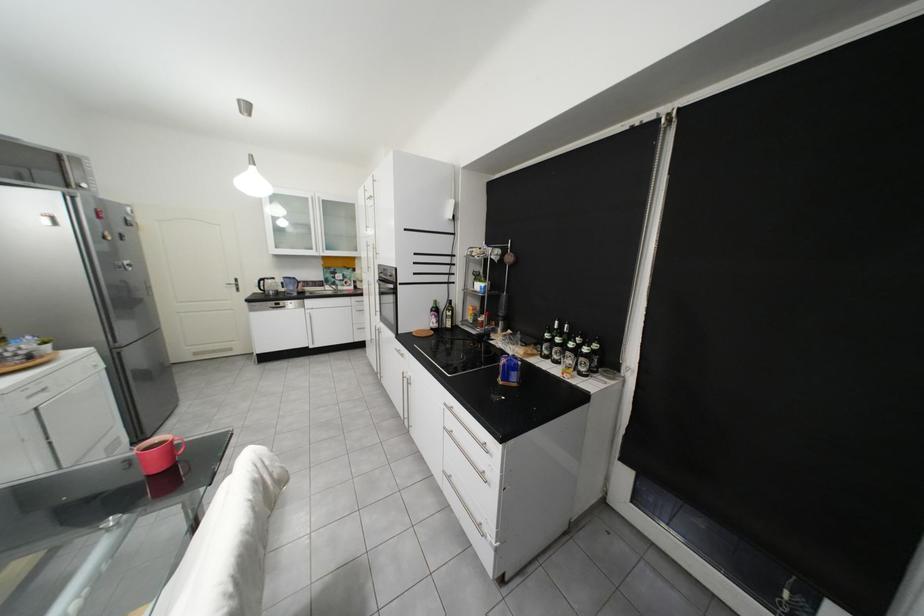
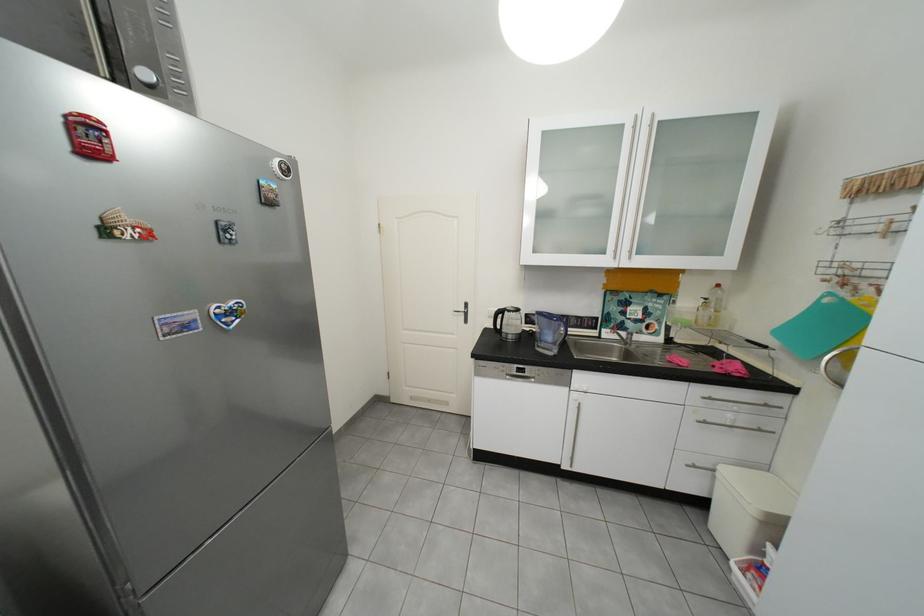
In the second image, find the point that corresponds to the point at 96,187 in the first image.

(156, 75)